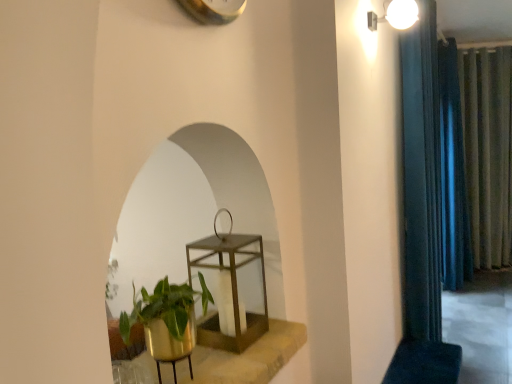
Locate an element on the screen. This screenshot has width=512, height=384. empty space that is ontop of gold metallic plant pot at lower left (from a real-world perspective) is located at coordinates (234, 354).